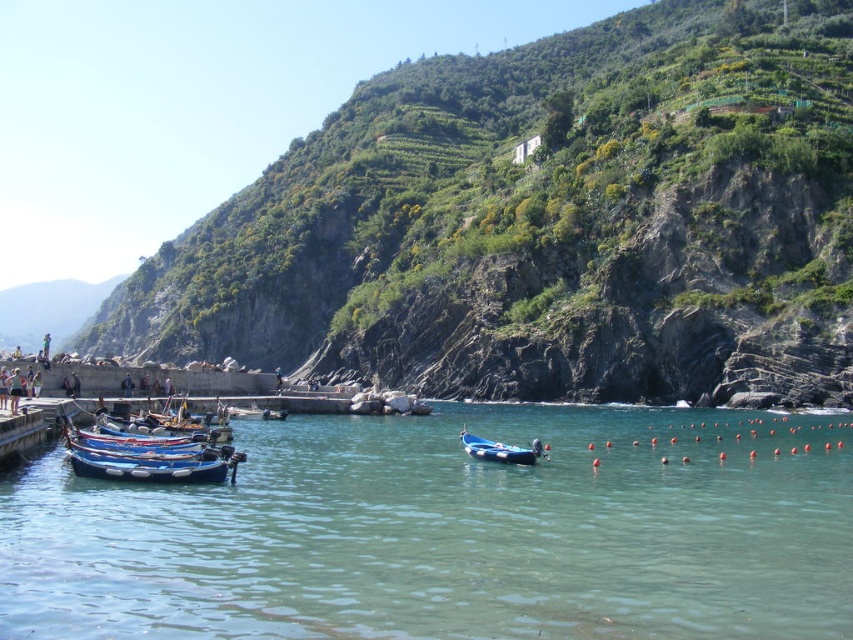
From the picture: Which is below, clear blue water at center or blue rubber boat at center?

clear blue water at center is lower down.

The image size is (853, 640). Describe the element at coordinates (451, 532) in the screenshot. I see `clear blue water at center` at that location.

Which is in front, point (55, 474) or point (497, 454)?

Positioned in front is point (55, 474).

The image size is (853, 640). What are the coordinates of `clear blue water at center` in the screenshot? It's located at (451, 532).

Between blue glossy boat at lower left and blue rubber boat at center, which one has less height?

blue rubber boat at center is shorter.

Can you confirm if blue glossy boat at lower left is positioned to the right of blue rubber boat at center?

In fact, blue glossy boat at lower left is to the left of blue rubber boat at center.

This screenshot has width=853, height=640. I want to click on blue glossy boat at lower left, so click(149, 458).

Is green leafy hillside at upper center behind clear blue water at center?

Yes, green leafy hillside at upper center is further from the viewer.

Does green leafy hillside at upper center have a larger size compared to clear blue water at center?

Correct, green leafy hillside at upper center is larger in size than clear blue water at center.

Identify the location of green leafy hillside at upper center. (547, 221).

The height and width of the screenshot is (640, 853). I want to click on green leafy hillside at upper center, so click(547, 221).